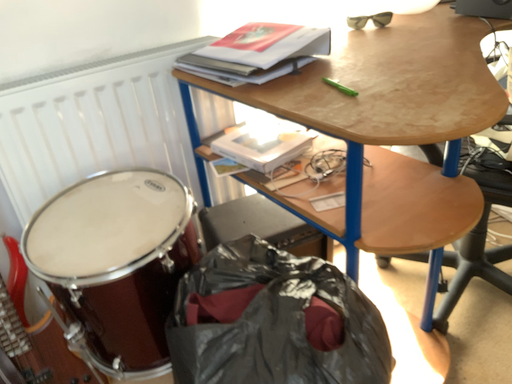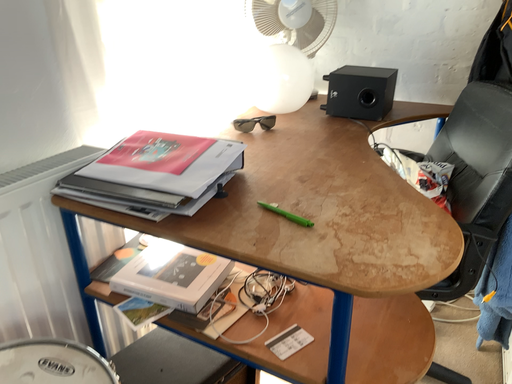
Question: Which way did the camera rotate in the video?

Choices:
 (A) rotated right
 (B) rotated left

Answer: (A)